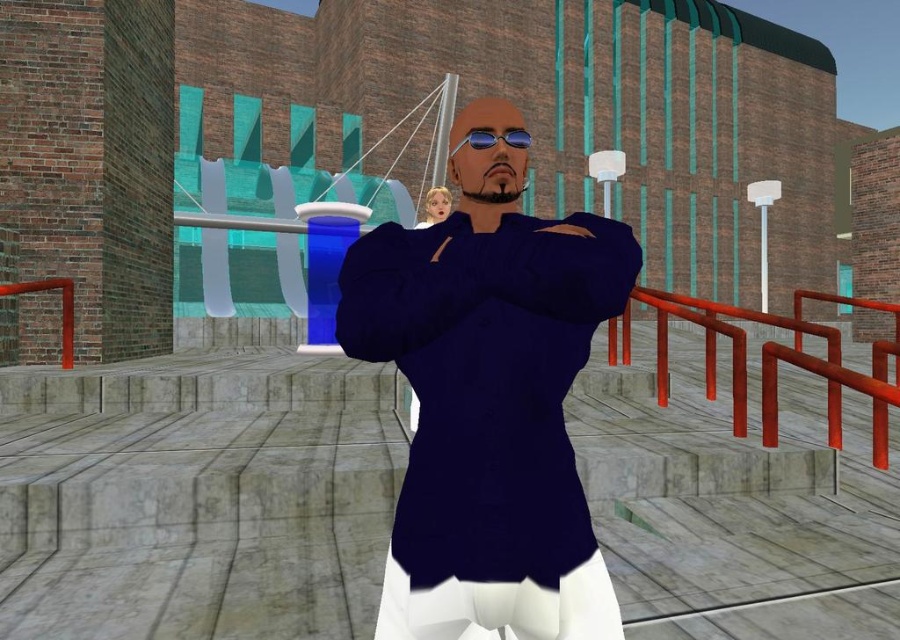
Image resolution: width=900 pixels, height=640 pixels. Describe the element at coordinates (779, 358) in the screenshot. I see `metallic red railing at right` at that location.

Which of these two, metallic red railing at right or blue reflective lenses at center, stands taller?

Standing taller between the two is metallic red railing at right.

Which is behind, point (682, 314) or point (522, 141)?

The point (682, 314) is behind.

Where is `metallic red railing at right`? This screenshot has width=900, height=640. metallic red railing at right is located at coordinates (779, 358).

Who is higher up, navy blue shirt at center or metallic red railing at right?

navy blue shirt at center is higher up.

Which is in front, point (540, 260) or point (897, 403)?

Point (540, 260) is in front.

Does point (513, 566) come behind point (651, 292)?

No.

Locate an element on the screen. navy blue shirt at center is located at coordinates (489, 406).

From the picture: Which is more to the right, rubberized red railing at left or blue reflective lenses at center?

blue reflective lenses at center is more to the right.

Which is behind, point (65, 330) or point (497, 132)?

Positioned behind is point (65, 330).

Locate an element on the screen. The height and width of the screenshot is (640, 900). rubberized red railing at left is located at coordinates (61, 308).